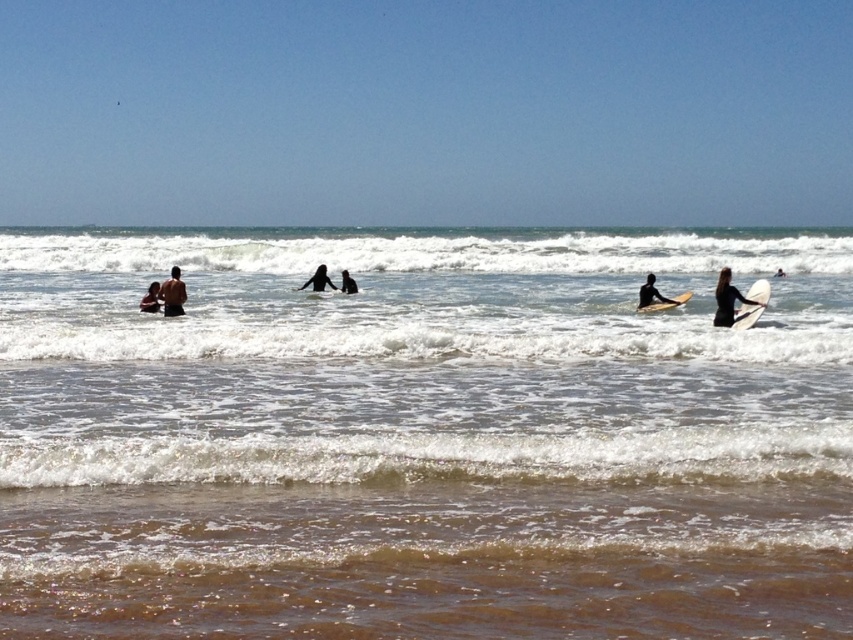
In the scene shown: You are standing on the beach and want to walk towards the black wetsuit surfer at center. Which direction should you move relative to the brown textured sand at lower center?

Since the brown textured sand at lower center is closer to you than the black wetsuit surfer at center, you should move away from the brown textured sand at lower center to reach the surfer.

You are a photographer trying to capture a photo of the light brown smooth surfboard at right and the brown textured sand at lower center. Which object is closer to the camera based on their positions?

The brown textured sand at lower center is positioned under the light brown smooth surfboard at right, meaning the surfboard is closer to the camera.